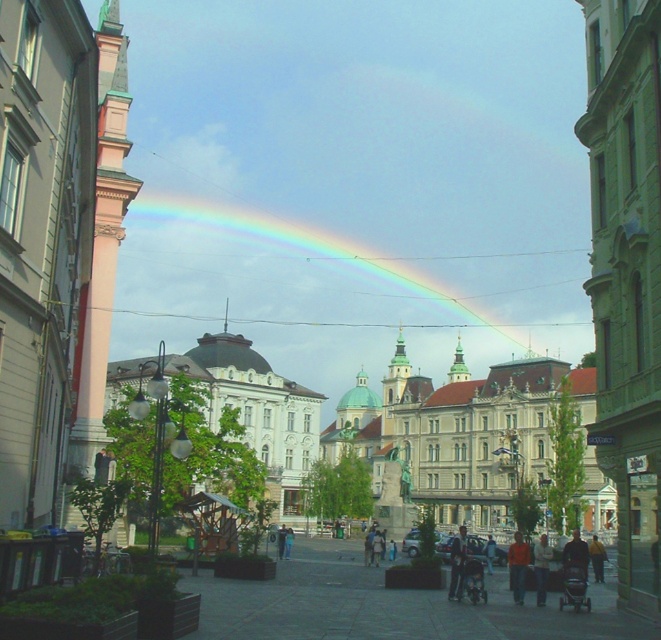
You are a photographer standing in the urban scene and want to capture a photo of both the dark blue jeans at center and the light brown leather jacket at lower center. Which object should you focus on first to ensure both are in frame?

You should focus on the light brown leather jacket at lower center first because the dark blue jeans at center is below it, ensuring both will be captured in the frame when centered on the lower object.

You are a photographer standing at the center of the street in this urban scene. You want to take a photo that includes both the point at coordinates point (514,576) and point (447,596). Which point should you focus on first to ensure both are in sharp focus?

You should focus on point (514,576) first because it is closer to the camera than point (447,596), ensuring both are within the depth of field.